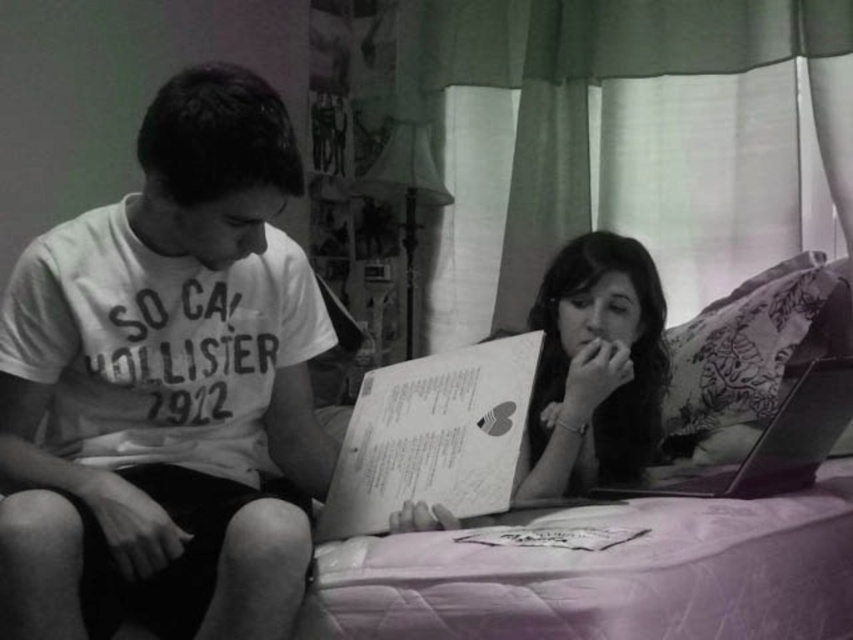
Consider the image. You have a small backpack with a 12 cm wide compartment. You need to place either the paperback book at center or the metallic silver laptop at lower right inside it. Which item can fit into the compartment?

The paperback book at center has a width less than the metallic silver laptop at lower right, so the paperback book at center can fit into the 12 cm wide compartment while the laptop cannot.

You are designing a storage box that must fit both the paperback book at center and the floral fabric pillow at upper right. Given their sizes, which item will require a larger storage space in terms of width?

The floral fabric pillow at upper right requires a larger storage space in terms of width since its width is greater than the paperback book at center.